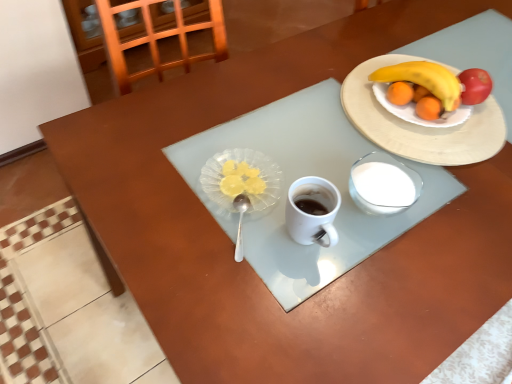
Question: Is yellow matte banana at upper right inside white ceramic plate at upper right?

Choices:
 (A) no
 (B) yes

Answer: (A)

Question: Can you confirm if white ceramic plate at upper right is positioned to the right of yellow matte banana at upper right?

Choices:
 (A) yes
 (B) no

Answer: (A)

Question: From a real-world perspective, is white ceramic plate at upper right over yellow matte banana at upper right?

Choices:
 (A) no
 (B) yes

Answer: (A)

Question: Would you consider white ceramic plate at upper right to be distant from yellow matte banana at upper right?

Choices:
 (A) no
 (B) yes

Answer: (A)

Question: Does white ceramic plate at upper right turn towards yellow matte banana at upper right?

Choices:
 (A) yes
 (B) no

Answer: (A)

Question: Would you say translucent glass plate at center is to the left or to the right of yellow matte banana at upper right in the picture?

Choices:
 (A) right
 (B) left

Answer: (B)

Question: From the image's perspective, is translucent glass plate at center located above or below yellow matte banana at upper right?

Choices:
 (A) above
 (B) below

Answer: (B)

Question: Looking at their shapes, would you say translucent glass plate at center is wider or thinner than yellow matte banana at upper right?

Choices:
 (A) wide
 (B) thin

Answer: (B)

Question: From a real-world perspective, relative to yellow matte banana at upper right, is translucent glass plate at center vertically above or below?

Choices:
 (A) below
 (B) above

Answer: (B)

Question: Is silver metallic spoon at center situated inside white ceramic plate at upper right or outside?

Choices:
 (A) outside
 (B) inside

Answer: (A)

Question: From the image's perspective, relative to white ceramic plate at upper right, is silver metallic spoon at center above or below?

Choices:
 (A) above
 (B) below

Answer: (B)

Question: From a real-world perspective, is silver metallic spoon at center physically located above or below white ceramic plate at upper right?

Choices:
 (A) above
 (B) below

Answer: (A)

Question: Considering the positions of silver metallic spoon at center and white ceramic plate at upper right in the image, is silver metallic spoon at center wider or thinner than white ceramic plate at upper right?

Choices:
 (A) thin
 (B) wide

Answer: (A)

Question: Considering the positions of white ceramic plate at upper right and translucent glass plate at center in the image, is white ceramic plate at upper right wider or thinner than translucent glass plate at center?

Choices:
 (A) thin
 (B) wide

Answer: (B)

Question: Is white ceramic plate at upper right taller or shorter than translucent glass plate at center?

Choices:
 (A) short
 (B) tall

Answer: (A)